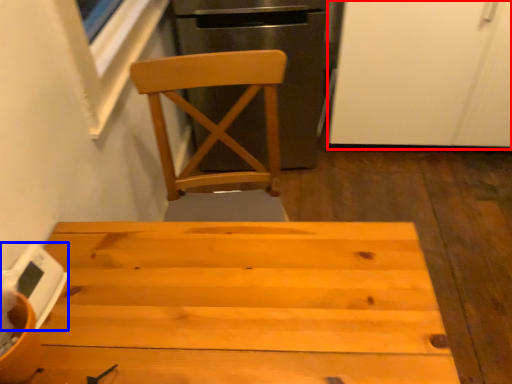
Question: Which of the following is the closest to the observer, screen door (highlighted by a red box) or appliance (highlighted by a blue box)?

Choices:
 (A) screen door
 (B) appliance

Answer: (B)